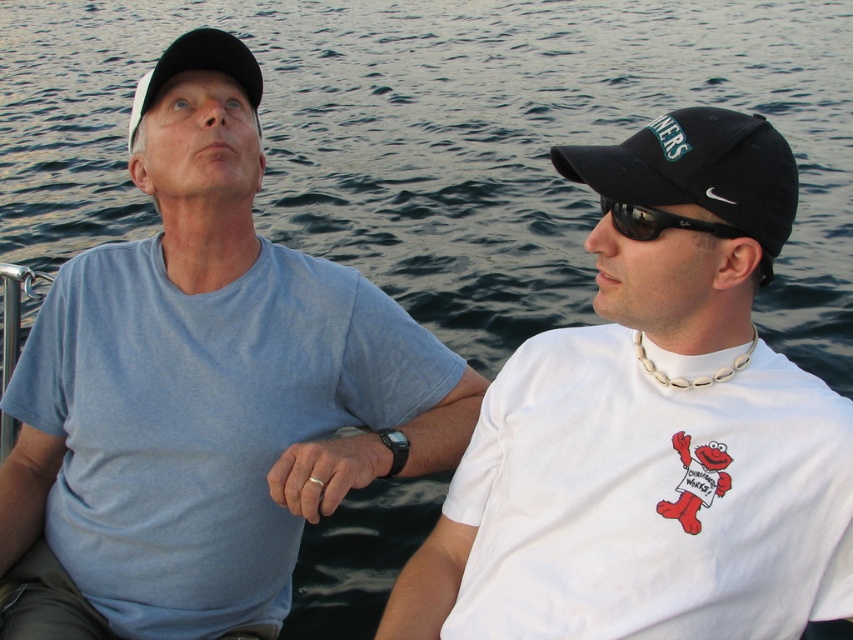
You are a photographer trying to capture a candid shot of the black reflective sunglasses at upper right and the dark blue water at center. Since you want to ensure both are in focus, which object should you position closer to the camera to achieve this?

To have both the black reflective sunglasses at upper right and the dark blue water at center in focus, you should position the camera so that the dark blue water at center is closer to the lens since it is already positioned to the left of the sunglasses, allowing for a depth of field that includes both.

You are a photographer trying to capture a wide shot of the dark blue water at center and the black reflective sunglasses at upper right. Which object will occupy more space in your photo?

The dark blue water at center will occupy more space in the photo because its width is larger than the black reflective sunglasses at upper right.